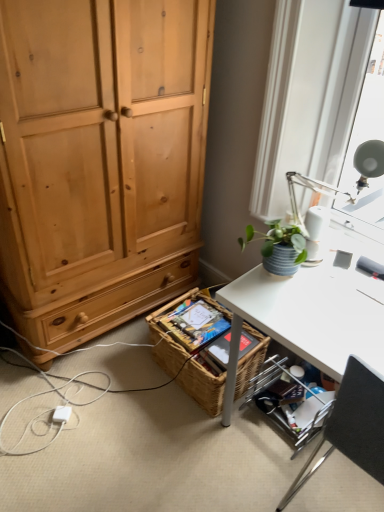
Question: Which is correct: woven brown picnic basket at lower center is inside metallic silver shelf at lower right, or outside of it?

Choices:
 (A) outside
 (B) inside

Answer: (A)

Question: From a real-world perspective, is woven brown picnic basket at lower center physically located above or below metallic silver shelf at lower right?

Choices:
 (A) below
 (B) above

Answer: (B)

Question: Which of these objects is positioned farthest from the woven brown picnic basket at lower center?

Choices:
 (A) metallic silver shelf at lower right
 (B) white plastic power outlet at lower left
 (C) black fabric chair at lower right

Answer: (C)

Question: Estimate the real-world distances between objects in this image. Which object is farther from the metallic silver shelf at lower right?

Choices:
 (A) black fabric chair at lower right
 (B) woven brown picnic basket at lower center
 (C) white plastic power outlet at lower left

Answer: (C)